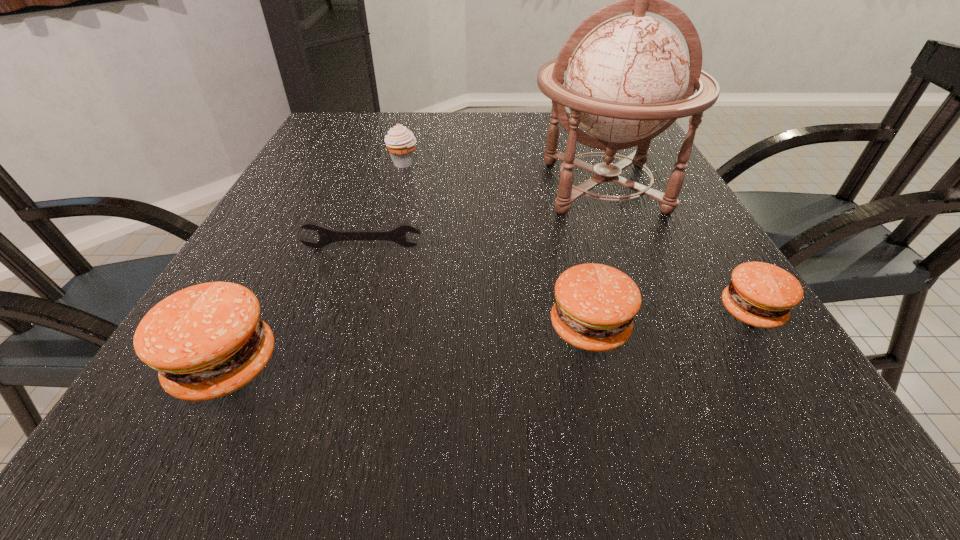
To achieve uniform spacing by inserting another patty_(food) among them, please point to a free space for this new patty_(food). Please provide its 2D coordinates. Your answer should be formatted as a tuple, i.e. [(x, y)], where the tuple contains the x and y coordinates of a point satisfying the conditions above.

[(415, 346)]